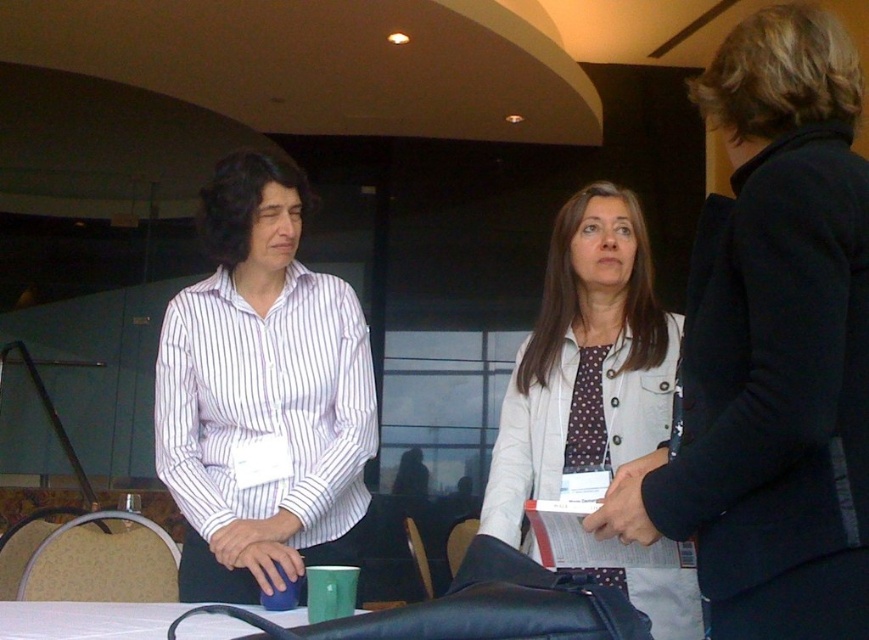
Question: Which of the following is the closest to the observer?

Choices:
 (A) white textured jacket at center
 (B) white glossy table at lower center

Answer: (A)

Question: Can you confirm if white textured jacket at center is positioned to the right of white glossy table at lower center?

Choices:
 (A) yes
 (B) no

Answer: (A)

Question: Which point is farther to the camera?

Choices:
 (A) white textured jacket at center
 (B) white glossy table at lower center

Answer: (B)

Question: From the image, what is the correct spatial relationship of white textured jacket at center in relation to white glossy table at lower center?

Choices:
 (A) below
 (B) above

Answer: (B)

Question: Which object is farther from the camera taking this photo?

Choices:
 (A) white glossy table at lower center
 (B) white textured jacket at center

Answer: (A)

Question: Does white textured jacket at center have a smaller size compared to white glossy table at lower center?

Choices:
 (A) yes
 (B) no

Answer: (B)